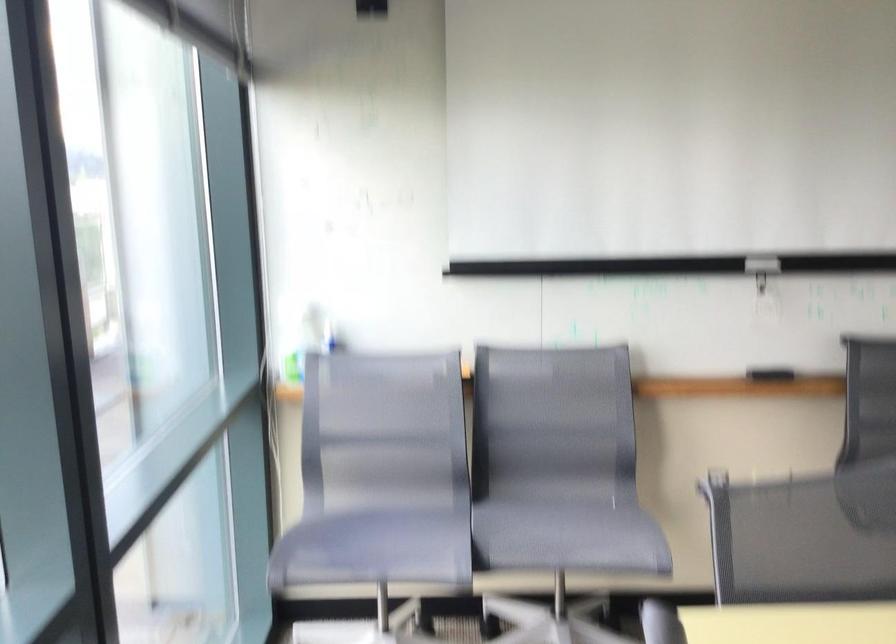
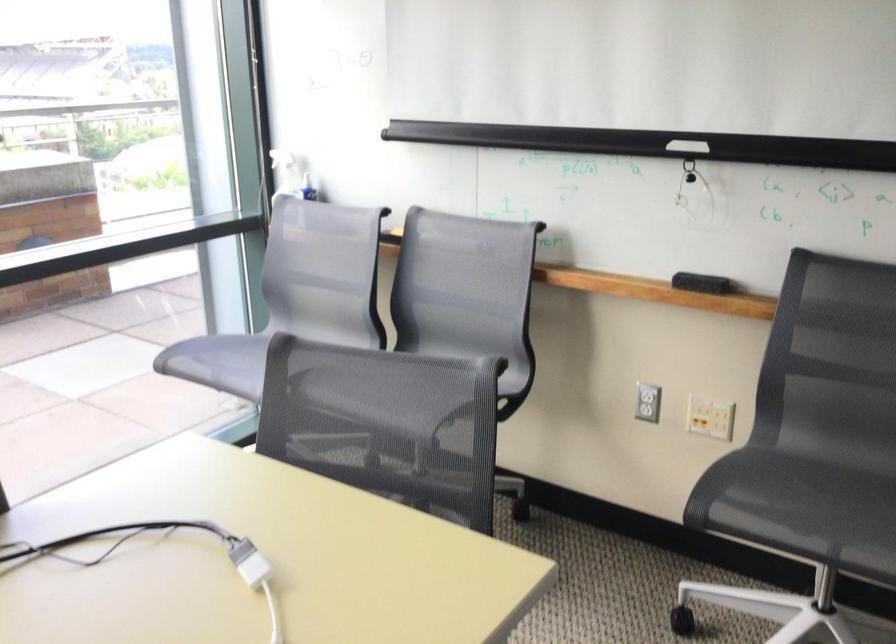
Locate, in the second image, the point that corresponds to pixel 341 551 in the first image.

(219, 362)